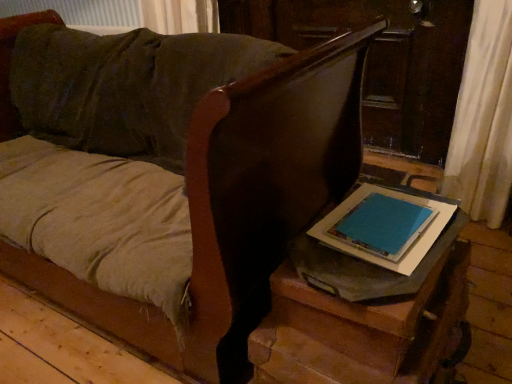
The height and width of the screenshot is (384, 512). Describe the element at coordinates (360, 317) in the screenshot. I see `matte gray table at lower right` at that location.

Measure the distance between point [286,341] and camera.

36.69 inches.

What is the approximate height of blue matte tablet at center?

blue matte tablet at center is 3.30 centimeters tall.

The height and width of the screenshot is (384, 512). Find the location of `matte gray table at lower right`. matte gray table at lower right is located at coordinates (360, 317).

In the image, is blue matte tablet at center positioned in front of or behind wooden side table at lower right?

In the image, blue matte tablet at center appears behind wooden side table at lower right.

Does blue matte tablet at center have a lesser width compared to wooden side table at lower right?

Yes, blue matte tablet at center is thinner than wooden side table at lower right.

Is blue matte tablet at center not close to wooden side table at lower right?

No, blue matte tablet at center is in close proximity to wooden side table at lower right.

Could you tell me if blue matte tablet at center is turned towards wooden side table at lower right?

No, blue matte tablet at center does not turn towards wooden side table at lower right.

Which of these two, wooden side table at lower right or blue matte tablet at center, stands shorter?

With less height is blue matte tablet at center.

From the picture: Is wooden side table at lower right in front of or behind blue matte tablet at center in the image?

Clearly, wooden side table at lower right is in front of blue matte tablet at center.

Does point (194, 136) come farther from viewer compared to point (360, 187)?

That is False.

Is wooden side table at lower right situated inside blue matte tablet at center or outside?

wooden side table at lower right is not enclosed by blue matte tablet at center.

Is matte gray table at lower right facing towards wooden side table at lower right?

No, matte gray table at lower right does not turn towards wooden side table at lower right.

Based on the photo, which is behind, matte gray table at lower right or wooden side table at lower right?

matte gray table at lower right.

From a real-world perspective, is matte gray table at lower right below wooden side table at lower right?

Indeed, from a real-world perspective, matte gray table at lower right is positioned beneath wooden side table at lower right.

Is wooden side table at lower right bigger than matte gray table at lower right?

Yes, wooden side table at lower right is bigger than matte gray table at lower right.

Is wooden side table at lower right outside of matte gray table at lower right?

Yes, wooden side table at lower right is not within matte gray table at lower right.

Which object is thinner, wooden side table at lower right or matte gray table at lower right?

matte gray table at lower right.

From the image's perspective, which is below, wooden side table at lower right or matte gray table at lower right?

matte gray table at lower right is shown below in the image.

Is blue matte tablet at center with matte gray table at lower right?

No, blue matte tablet at center is not in contact with matte gray table at lower right.

From the image's perspective, between blue matte tablet at center and matte gray table at lower right, which one is located above?

From the image's view, blue matte tablet at center is above.

Considering the relative sizes of blue matte tablet at center and matte gray table at lower right in the image provided, is blue matte tablet at center bigger than matte gray table at lower right?

Incorrect, blue matte tablet at center is not larger than matte gray table at lower right.

Is matte gray table at lower right surrounding blue matte tablet at center?

Yes, blue matte tablet at center is surrounded by matte gray table at lower right.

Is matte gray table at lower right oriented towards blue matte tablet at center?

No, matte gray table at lower right is not aimed at blue matte tablet at center.

Is matte gray table at lower right to the left of blue matte tablet at center from the viewer's perspective?

Indeed, matte gray table at lower right is positioned on the left side of blue matte tablet at center.

What's the angular difference between matte gray table at lower right and blue matte tablet at center's facing directions?

8.02 degrees separate the facing orientations of matte gray table at lower right and blue matte tablet at center.

At what (x,y) coordinates should I click in order to perform the action: click on furniture in front of the blue matte tablet at center. Please return your answer as a coordinate pair (x, y). Looking at the image, I should click on (240, 205).

Where is `tablet computer that appears behind the wooden side table at lower right`? The image size is (512, 384). tablet computer that appears behind the wooden side table at lower right is located at coordinates (386, 225).

Based on their spatial positions, is wooden side table at lower right or blue matte tablet at center closer to matte gray table at lower right?

blue matte tablet at center is positioned closer to the anchor matte gray table at lower right.

In the scene shown: Considering their positions, is matte gray table at lower right positioned further to wooden side table at lower right than blue matte tablet at center?

blue matte tablet at center is positioned further to the anchor wooden side table at lower right.

Based on their spatial positions, is wooden side table at lower right or matte gray table at lower right further from blue matte tablet at center?

wooden side table at lower right is positioned further to the anchor blue matte tablet at center.

Based on their spatial positions, is matte gray table at lower right or wooden side table at lower right closer to blue matte tablet at center?

Based on the image, matte gray table at lower right appears to be nearer to blue matte tablet at center.

Looking at the image, which one is located closer to matte gray table at lower right, blue matte tablet at center or wooden side table at lower right?

Among the two, blue matte tablet at center is located nearer to matte gray table at lower right.

From the image, which object appears to be nearer to wooden side table at lower right, blue matte tablet at center or matte gray table at lower right?

matte gray table at lower right is closer to wooden side table at lower right.

The width and height of the screenshot is (512, 384). Find the location of `table between wooden side table at lower right and blue matte tablet at center in the horizontal direction`. table between wooden side table at lower right and blue matte tablet at center in the horizontal direction is located at coordinates (360, 317).